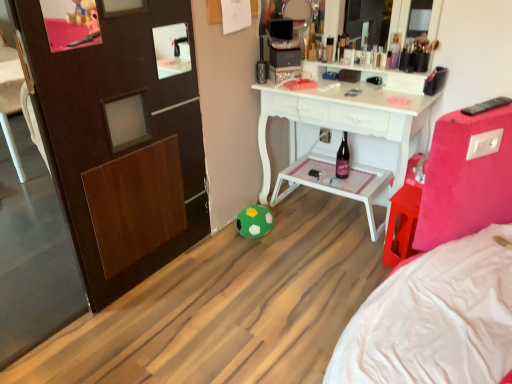
Question: Considering the positions of point (487, 104) and point (289, 192), is point (487, 104) closer or farther from the camera than point (289, 192)?

Choices:
 (A) farther
 (B) closer

Answer: (B)

Question: Looking at their shapes, would you say black plastic remote control at upper right is wider or thinner than white plastic tray at center?

Choices:
 (A) wide
 (B) thin

Answer: (B)

Question: Estimate the real-world distances between objects in this image. Which object is farther from the metallic silver toiletries at upper center, which appears as the 2th toiletry when viewed from the left?

Choices:
 (A) metallic silver toiletry at center, acting as the second toiletry starting from the right
 (B) black plastic remote control at upper right
 (C) white plastic tray at center
 (D) green felt ball at lower center
 (E) dark glass bottle at center

Answer: (B)

Question: Estimate the real-world distances between objects in this image. Which object is farther from the metallic silver toiletries at upper center, placed as the 1th toiletry when sorted from right to left?

Choices:
 (A) white plastic tray at center
 (B) black plastic remote control at upper right
 (C) green felt ball at lower center
 (D) metallic silver toiletry at center, acting as the second toiletry starting from the right
 (E) dark glass bottle at center

Answer: (B)